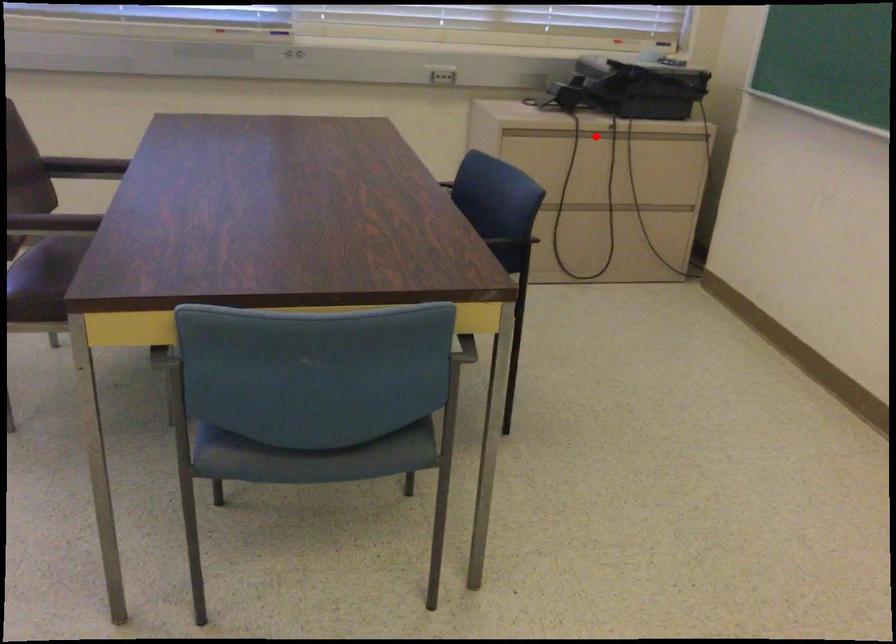
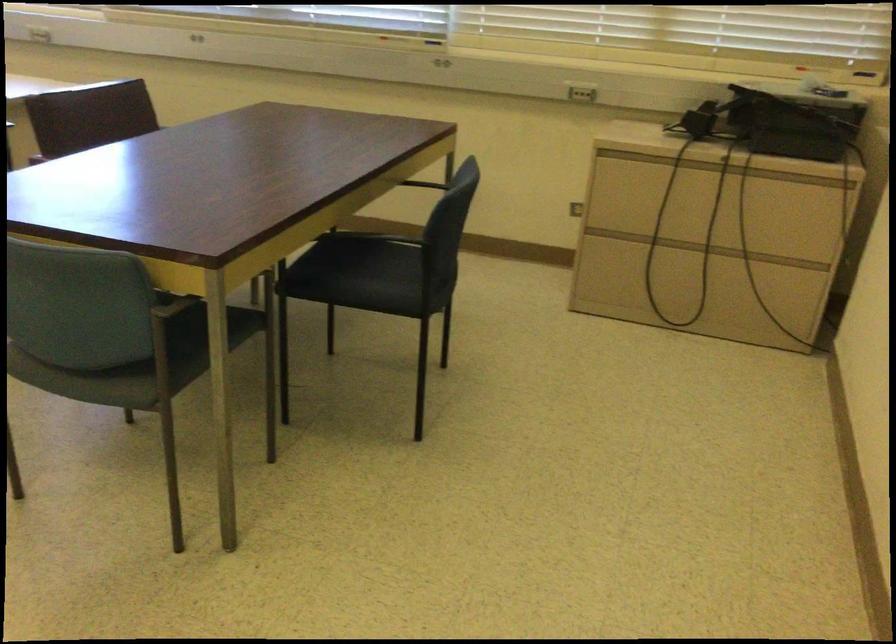
The point at the highlighted location is marked in the first image. Where is the corresponding point in the second image?

(700, 167)